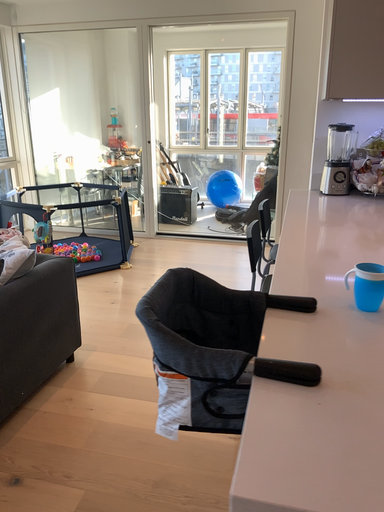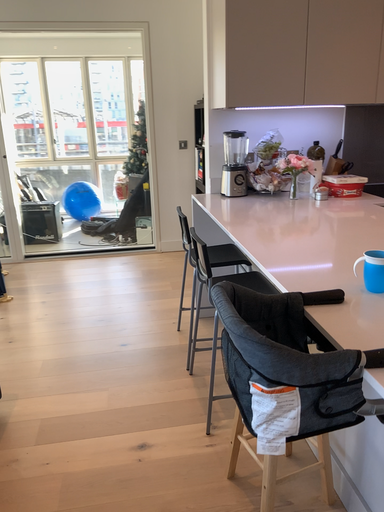
Question: How did the camera likely rotate when shooting the video?

Choices:
 (A) rotated right
 (B) rotated left

Answer: (A)